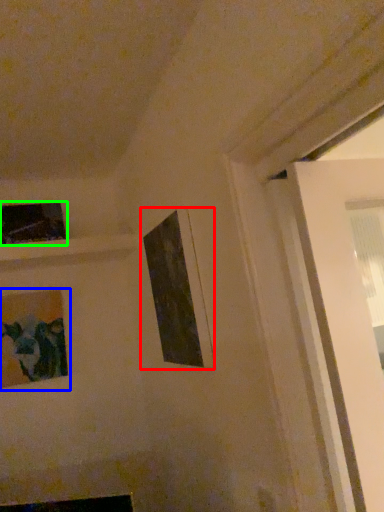
Question: Which object is positioned closest to picture frame (highlighted by a red box)? Select from picture frame (highlighted by a blue box) and picture frame (highlighted by a green box).

Choices:
 (A) picture frame
 (B) picture frame

Answer: (A)